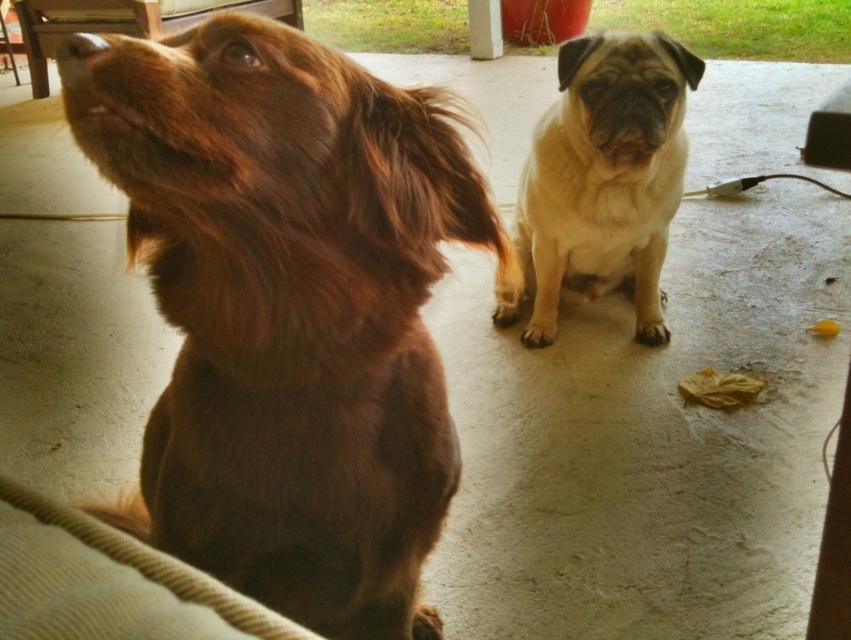
Who is more forward, (310, 625) or (535, 305)?

Positioned in front is point (310, 625).

Which of these two, brown furry dog at left or beige fur dog at center, stands shorter?

brown furry dog at left is shorter.

Between point (240, 573) and point (650, 330), which one is positioned behind?

The point (650, 330) is behind.

The height and width of the screenshot is (640, 851). I want to click on brown furry dog at left, so click(288, 308).